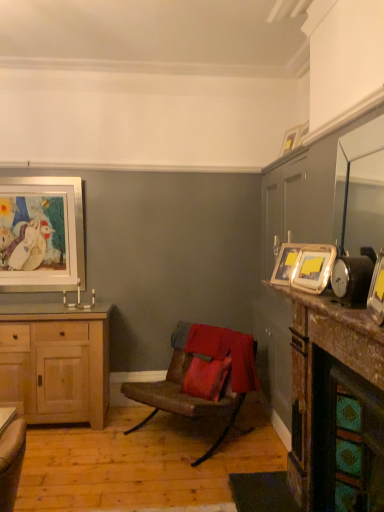
Identify the location of vacant space underneath matte white picture frame at upper left, which is the 5th picture frame from right to left (from a real-world perspective). (31, 305).